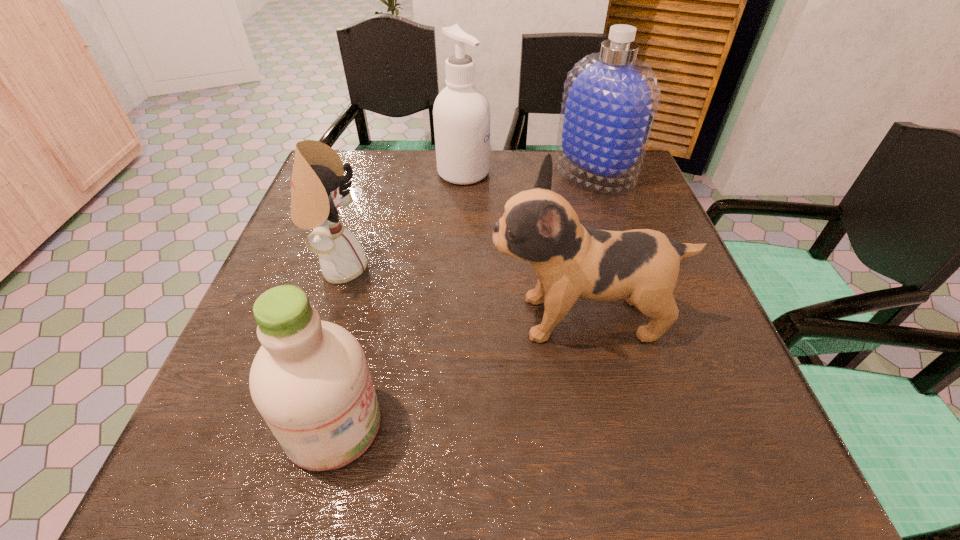
Where is `free point located at the face of the puppy`? The height and width of the screenshot is (540, 960). free point located at the face of the puppy is located at coordinates (369, 318).

Locate an element on the screen. This screenshot has height=540, width=960. vacant space located 0.060m at the front face of the doll is located at coordinates (396, 268).

Find the location of a particular element. vacant space located 0.080m on the front label of the leftmost cleansing agent is located at coordinates (433, 425).

The width and height of the screenshot is (960, 540). I want to click on object that is at the near edge, so click(310, 381).

This screenshot has height=540, width=960. I want to click on doll located in the left edge section of the desktop, so click(317, 185).

Locate an element on the screen. The height and width of the screenshot is (540, 960). cleansing agent located at the left edge is located at coordinates (310, 381).

Where is `cleansing agent that is at the right edge`? The image size is (960, 540). cleansing agent that is at the right edge is located at coordinates (610, 99).

What are the coordinates of `puppy at the right edge` in the screenshot? It's located at (641, 266).

Locate an element on the screen. object present at the near left corner is located at coordinates (310, 381).

Find the location of `object that is at the far right corner`. object that is at the far right corner is located at coordinates (610, 99).